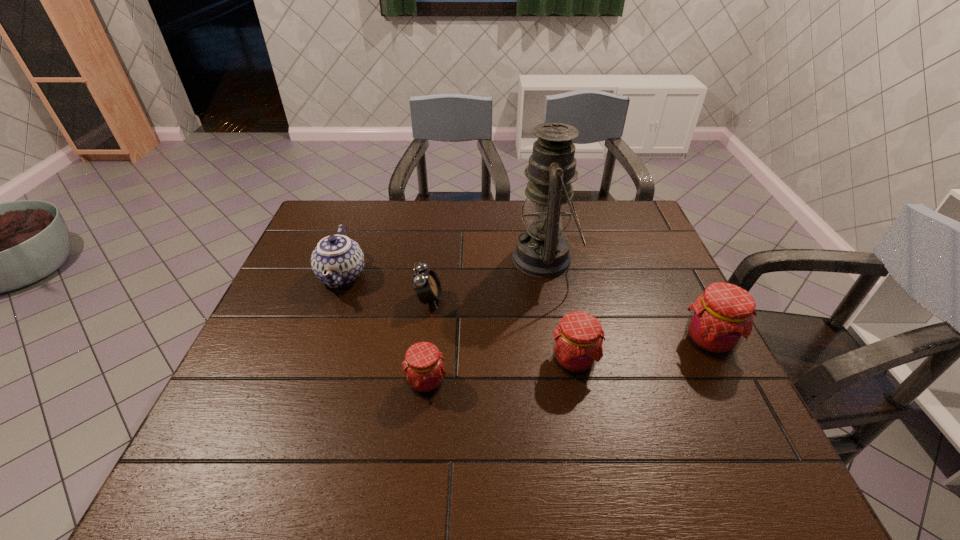
You are a GUI agent. You are given a task and a screenshot of the screen. Output one action in this format:
    pyautogui.click(x=<x>, y=<y>)
    Task: Click on the shortest jam
    This screenshot has height=540, width=960.
    Given the screenshot: What is the action you would take?
    pyautogui.click(x=423, y=365)

What are the coordinates of `the shortest object` in the screenshot? It's located at (423, 365).

Locate an element on the screen. Image resolution: width=960 pixels, height=540 pixels. the second tallest jam is located at coordinates (577, 347).

At what (x,y) coordinates should I click in order to perform the action: click on the rightmost jam. Please return your answer as a coordinate pair (x, y). Looking at the image, I should click on (721, 318).

You are a GUI agent. You are given a task and a screenshot of the screen. Output one action in this format:
    pyautogui.click(x=<x>, y=<y>)
    Task: Click on the rightmost object
    This screenshot has width=960, height=540.
    Given the screenshot: What is the action you would take?
    pyautogui.click(x=721, y=318)

The width and height of the screenshot is (960, 540). What are the coordinates of `oil lamp` in the screenshot? It's located at (542, 251).

At what (x,y) coordinates should I click in order to perform the action: click on chinaware. Please return your answer as a coordinate pair (x, y). The width and height of the screenshot is (960, 540). Looking at the image, I should click on (337, 261).

Image resolution: width=960 pixels, height=540 pixels. What are the coordinates of `alarm clock` in the screenshot? It's located at (426, 283).

This screenshot has height=540, width=960. I want to click on free space located 0.210m on the right of the leftmost jam, so click(x=540, y=383).

Identify the location of vacant region located on the back of the second jam from right to left. The width and height of the screenshot is (960, 540). (559, 288).